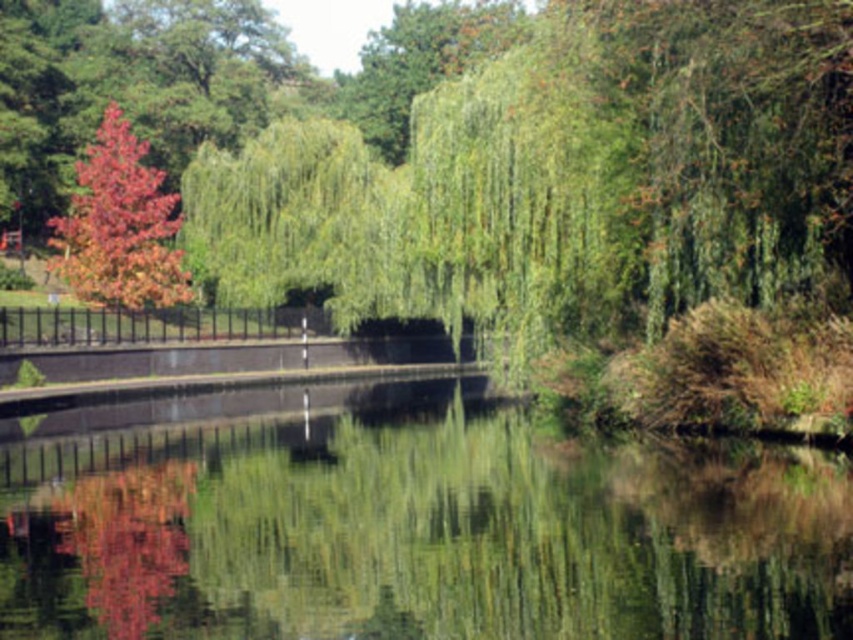
Is green reflective water at center bigger than shiny red leaves at left?

No, green reflective water at center is not bigger than shiny red leaves at left.

The height and width of the screenshot is (640, 853). Describe the element at coordinates (415, 528) in the screenshot. I see `green reflective water at center` at that location.

Find the location of a particular element. Image resolution: width=853 pixels, height=640 pixels. green reflective water at center is located at coordinates (415, 528).